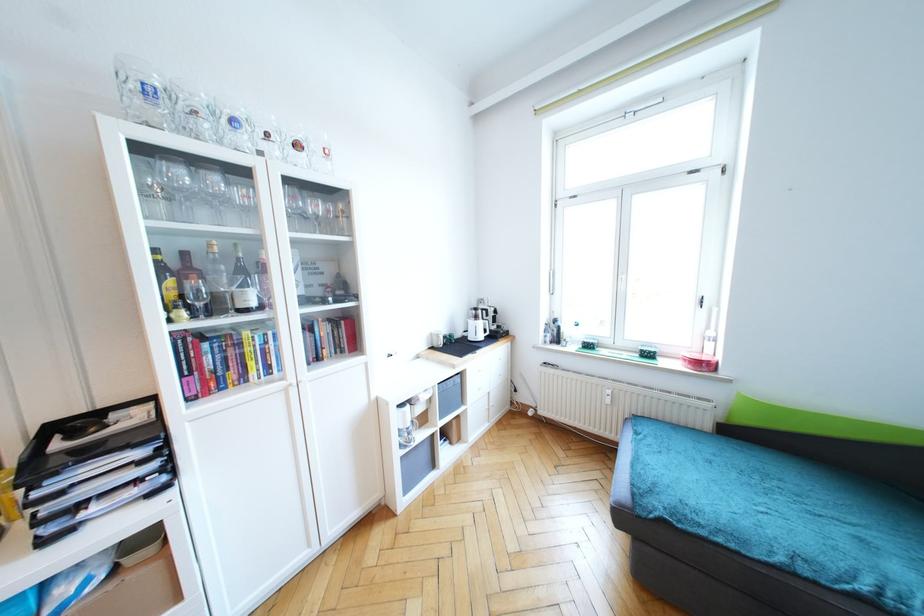
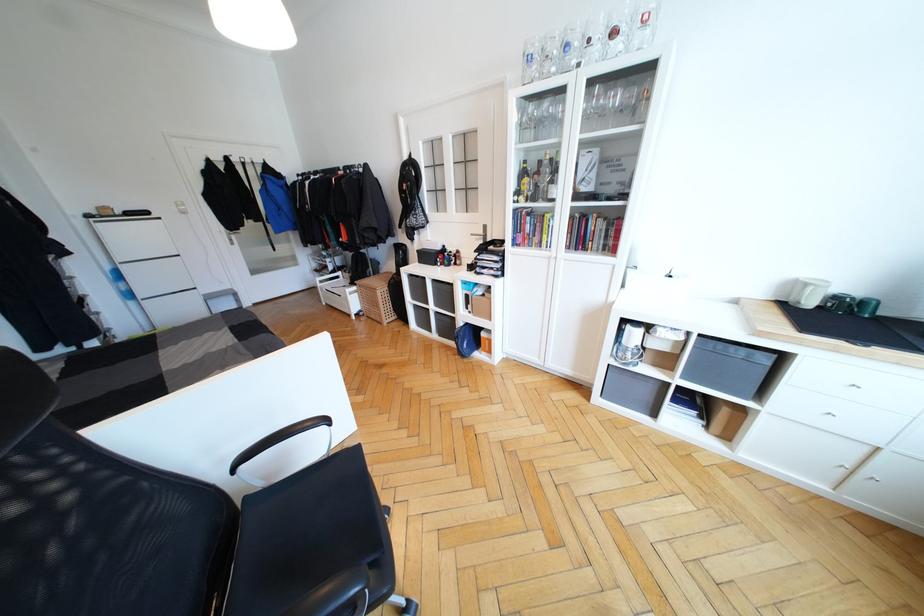
Consider the image. First-person continuous shooting, in which direction is the camera rotating?

The rotation direction of the camera is left-down.